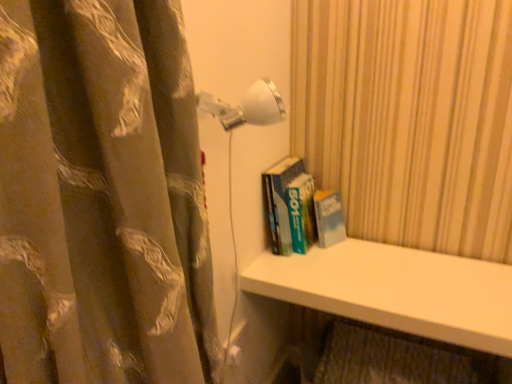
You are a GUI agent. You are given a task and a screenshot of the screen. Output one action in this format:
    pyautogui.click(x=<x>, y=<y>)
    Task: Click on the free space in front of hardcover book at center
    The height and width of the screenshot is (384, 512).
    Given the screenshot: What is the action you would take?
    pyautogui.click(x=310, y=279)